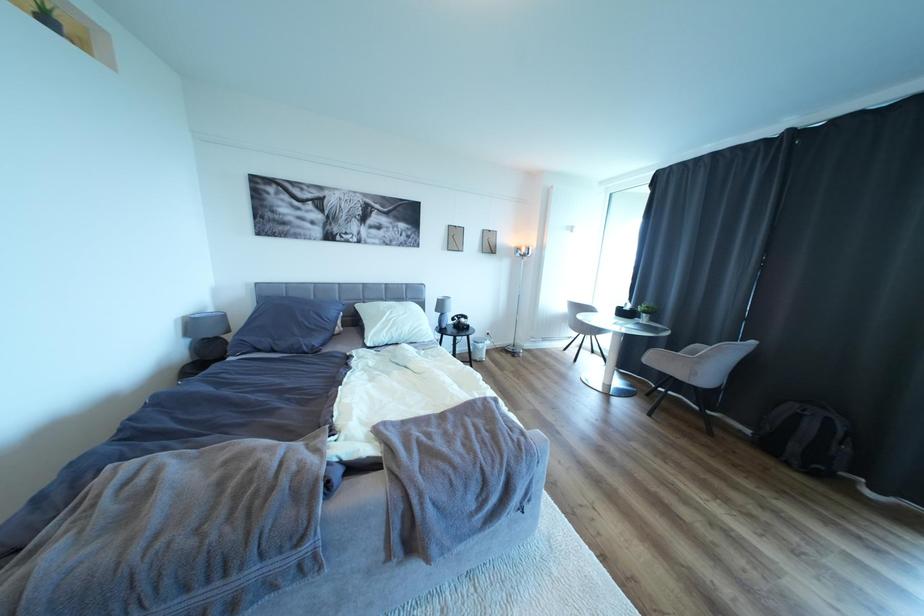
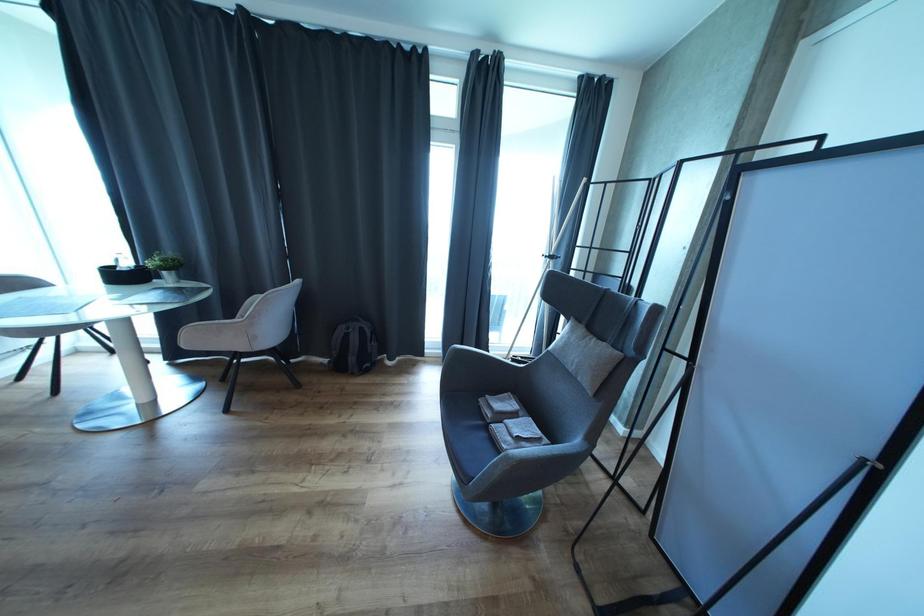
The images are taken continuously from a first-person perspective. In which direction is your viewpoint rotating?

The camera rotated toward right-down.